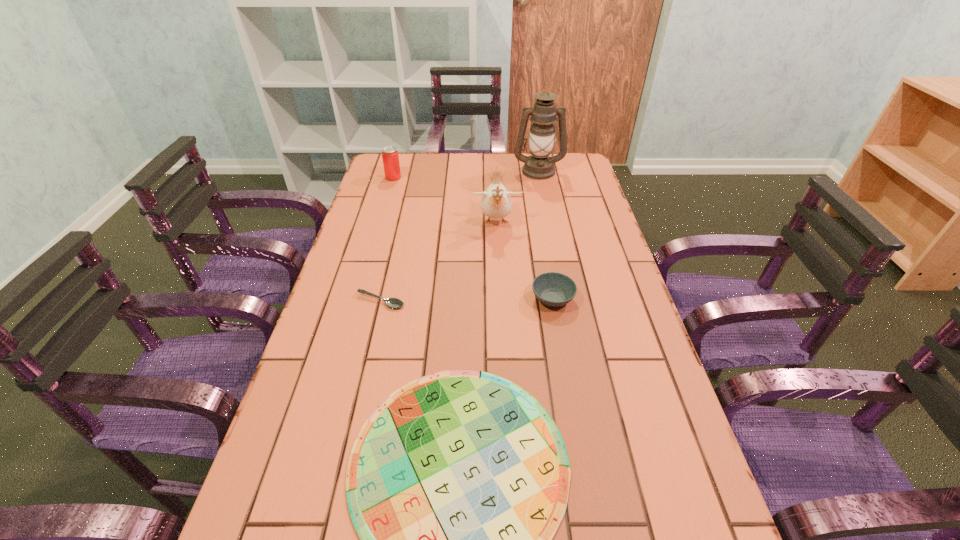
Locate an element on the screen. Image resolution: width=960 pixels, height=540 pixels. vacant space at the left edge is located at coordinates (399, 202).

In the image, there is a desktop. Identify the location of free region at the right edge. The height and width of the screenshot is (540, 960). (570, 276).

The image size is (960, 540). Find the location of `vacant space that's between the fourth shortest object and the soupspoon`. vacant space that's between the fourth shortest object and the soupspoon is located at coordinates (387, 239).

Locate an element on the screen. Image resolution: width=960 pixels, height=540 pixels. free space between the bird and the fourth tallest object is located at coordinates (524, 261).

In order to click on free space between the fifth tallest object and the can in this screenshot , I will do `click(387, 239)`.

At what (x,y) coordinates should I click in order to perform the action: click on blank region between the third farthest object and the soup bowl. Please return your answer as a coordinate pair (x, y). Image resolution: width=960 pixels, height=540 pixels. Looking at the image, I should click on (524, 261).

You are a GUI agent. You are given a task and a screenshot of the screen. Output one action in this format:
    pyautogui.click(x=<x>, y=<y>)
    Task: Click on the free space between the fifth tallest object and the fourth shortest object
    The width and height of the screenshot is (960, 540).
    Given the screenshot: What is the action you would take?
    pyautogui.click(x=387, y=239)

Locate an element on the screen. This screenshot has width=960, height=540. free area in between the soup bowl and the can is located at coordinates (473, 238).

In order to click on free space between the fourth shortest object and the third farthest object in this screenshot , I will do `click(444, 200)`.

Locate an element on the screen. vacant space that is in between the fourth nearest object and the second shortest object is located at coordinates (439, 262).